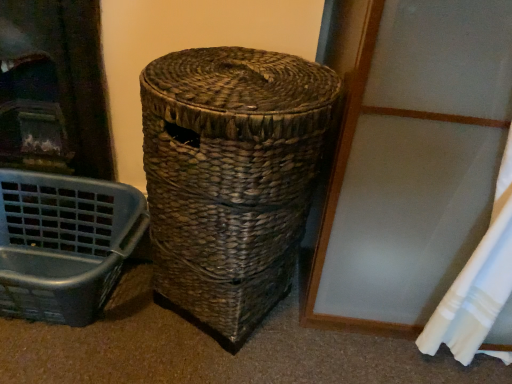
The width and height of the screenshot is (512, 384). Describe the element at coordinates (231, 176) in the screenshot. I see `woven brown basket at center` at that location.

Where is `woven brown basket at center`? This screenshot has width=512, height=384. woven brown basket at center is located at coordinates (231, 176).

The height and width of the screenshot is (384, 512). Find the location of `matte plastic laundry basket at lower left`. matte plastic laundry basket at lower left is located at coordinates pos(64,243).

Locate an element on the screen. white fabric curtain at lower right is located at coordinates tap(478, 284).

Can you confirm if matte plastic laundry basket at lower left is taller than white fabric curtain at lower right?

Incorrect, the height of matte plastic laundry basket at lower left is not larger of that of white fabric curtain at lower right.

Find the location of a particular element. furniture below the white fabric curtain at lower right (from a real-world perspective) is located at coordinates (64, 243).

Consider the image. Is matte plastic laundry basket at lower left turned away from white fabric curtain at lower right?

No.

Is white fabric curtain at lower right in front of or behind matte plastic laundry basket at lower left in the image?

white fabric curtain at lower right is positioned closer to the viewer than matte plastic laundry basket at lower left.

In the scene shown: From the image's perspective, is white fabric curtain at lower right above or below matte plastic laundry basket at lower left?

white fabric curtain at lower right is above matte plastic laundry basket at lower left.

Is white fabric curtain at lower right looking in the opposite direction of matte plastic laundry basket at lower left?

No, matte plastic laundry basket at lower left is not at the back of white fabric curtain at lower right.

Is white fabric curtain at lower right taller or shorter than matte plastic laundry basket at lower left?

Considering their sizes, white fabric curtain at lower right has more height than matte plastic laundry basket at lower left.

Locate an element on the screen. basket lying behind the white fabric curtain at lower right is located at coordinates (231, 176).

Is woven brown basket at center smaller than white fabric curtain at lower right?

No.

Based on the photo, can you tell me how much woven brown basket at center and white fabric curtain at lower right differ in facing direction?

The angle between the facing direction of woven brown basket at center and the facing direction of white fabric curtain at lower right is 17.7 degrees.

Is matte plastic laundry basket at lower left in front of or behind woven brown basket at center in the image?

Clearly, matte plastic laundry basket at lower left is behind woven brown basket at center.

You are a GUI agent. You are given a task and a screenshot of the screen. Output one action in this format:
    pyautogui.click(x=<x>, y=<y>)
    Task: Click on the basket in front of the matte plastic laundry basket at lower left
    
    Given the screenshot: What is the action you would take?
    pyautogui.click(x=231, y=176)

Is matte plastic laundry basket at lower left touching woven brown basket at center?

No, matte plastic laundry basket at lower left is not in contact with woven brown basket at center.

Is matte plastic laundry basket at lower left aimed at woven brown basket at center?

No, matte plastic laundry basket at lower left does not turn towards woven brown basket at center.

Is woven brown basket at center with matte plastic laundry basket at lower left?

No, woven brown basket at center is not making contact with matte plastic laundry basket at lower left.

Is point (262, 206) positioned before point (19, 259)?

Yes.

Considering the relative positions of woven brown basket at center and matte plastic laundry basket at lower left in the image provided, is woven brown basket at center to the left or to the right of matte plastic laundry basket at lower left?

woven brown basket at center is to the right of matte plastic laundry basket at lower left.

From a real-world perspective, is woven brown basket at center positioned above or below matte plastic laundry basket at lower left?

Clearly, from a real-world perspective, woven brown basket at center is above matte plastic laundry basket at lower left.

From the image's perspective, is white fabric curtain at lower right located above or below woven brown basket at center?

Clearly, from the image's perspective, white fabric curtain at lower right is below woven brown basket at center.

Which is behind, white fabric curtain at lower right or woven brown basket at center?

woven brown basket at center is further away from the camera.

In terms of height, does white fabric curtain at lower right look taller or shorter compared to woven brown basket at center?

white fabric curtain at lower right is taller than woven brown basket at center.

You are a GUI agent. You are given a task and a screenshot of the screen. Output one action in this format:
    pyautogui.click(x=<x>, y=<y>)
    Task: Click on the curtain above the matte plastic laundry basket at lower left (from a real-world perspective)
    This screenshot has width=512, height=384.
    Given the screenshot: What is the action you would take?
    pyautogui.click(x=478, y=284)

Identify the location of furniture behind the white fabric curtain at lower right. (64, 243).

Based on their spatial positions, is woven brown basket at center or matte plastic laundry basket at lower left further from white fabric curtain at lower right?

matte plastic laundry basket at lower left.

From the image, which object appears to be farther from matte plastic laundry basket at lower left, woven brown basket at center or white fabric curtain at lower right?

Based on the image, white fabric curtain at lower right appears to be further to matte plastic laundry basket at lower left.

Based on their spatial positions, is matte plastic laundry basket at lower left or white fabric curtain at lower right closer to woven brown basket at center?

matte plastic laundry basket at lower left lies closer to woven brown basket at center than the other object.

In the scene shown: Which object lies further to the anchor point woven brown basket at center, white fabric curtain at lower right or matte plastic laundry basket at lower left?

white fabric curtain at lower right is positioned further to the anchor woven brown basket at center.

From the picture: From the image, which object appears to be nearer to matte plastic laundry basket at lower left, white fabric curtain at lower right or woven brown basket at center?

woven brown basket at center.

Based on their spatial positions, is matte plastic laundry basket at lower left or woven brown basket at center further from white fabric curtain at lower right?

Among the two, matte plastic laundry basket at lower left is located further to white fabric curtain at lower right.

The image size is (512, 384). In order to click on basket between matte plastic laundry basket at lower left and white fabric curtain at lower right in this screenshot , I will do `click(231, 176)`.